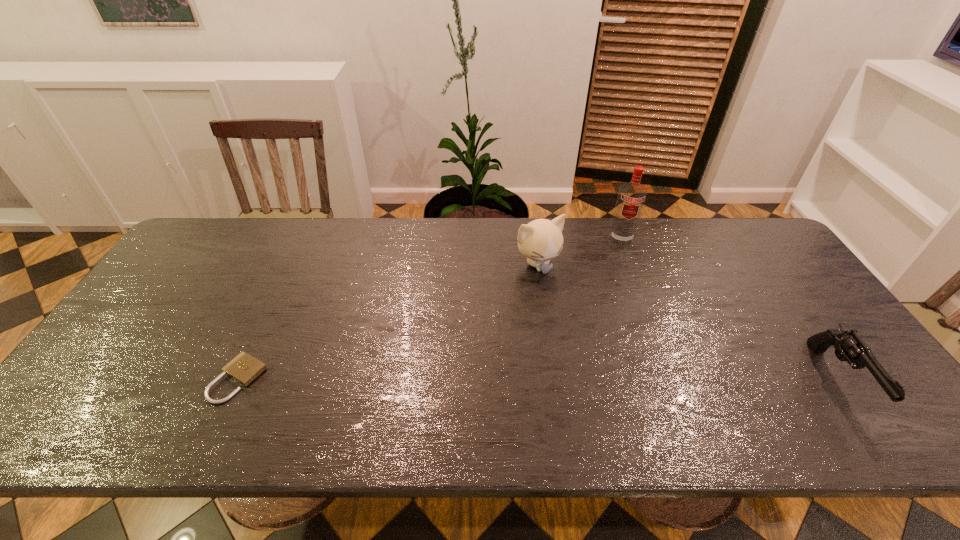
Locate an element on the screen. The height and width of the screenshot is (540, 960). unoccupied position between the third object from right to left and the gun is located at coordinates 687,322.

Identify the location of free space between the second farthest object and the rightmost object. (687, 322).

Locate an element on the screen. unoccupied position between the leftmost object and the gun is located at coordinates (539, 379).

I want to click on vacant space that is in between the shortest object and the rightmost object, so click(539, 379).

Find the location of a particular element. The height and width of the screenshot is (540, 960). free spot between the shortest object and the second shortest object is located at coordinates (539, 379).

I want to click on vacant point located between the third object from left to right and the shortest object, so click(429, 309).

This screenshot has height=540, width=960. I want to click on object that is the third closest to the shortest object, so click(x=849, y=346).

At what (x,y) coordinates should I click in order to perform the action: click on object that can be found as the second closest to the shortest object. Please return your answer as a coordinate pair (x, y). Looking at the image, I should click on [631, 197].

Where is `vacant position in the image that satisfies the following two spatial constraints: 1. on the back side of the third nearest object; 2. on the right side of the leftmost object`? vacant position in the image that satisfies the following two spatial constraints: 1. on the back side of the third nearest object; 2. on the right side of the leftmost object is located at coordinates (293, 265).